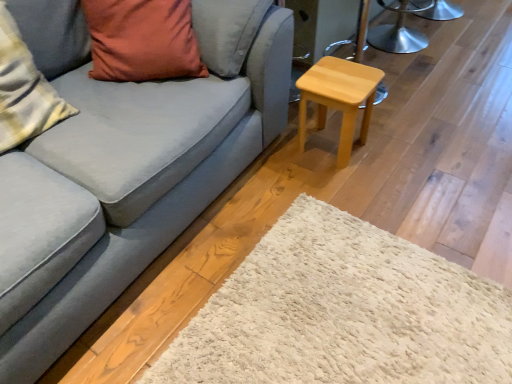
Question: From the image's perspective, is light wood/stained stool at right on matte orange pillow at upper left, which is counted as the second pillow, starting from the left?

Choices:
 (A) yes
 (B) no

Answer: (B)

Question: Can you confirm if light wood/stained stool at right is shorter than matte orange pillow at upper left, which is counted as the second pillow, starting from the left?

Choices:
 (A) no
 (B) yes

Answer: (B)

Question: Is light wood/stained stool at right wider than matte orange pillow at upper left, which is counted as the second pillow, starting from the left?

Choices:
 (A) yes
 (B) no

Answer: (B)

Question: Does light wood/stained stool at right appear on the right side of matte orange pillow at upper left, which is counted as the second pillow, starting from the left?

Choices:
 (A) no
 (B) yes

Answer: (B)

Question: Can you confirm if light wood/stained stool at right is smaller than matte orange pillow at upper left, which is counted as the second pillow, starting from the left?

Choices:
 (A) no
 (B) yes

Answer: (B)

Question: From the image's perspective, does light wood/stained stool at right appear lower than matte orange pillow at upper left, the first pillow in the right-to-left sequence?

Choices:
 (A) no
 (B) yes

Answer: (B)

Question: Is metallic silver stool at upper right not close to plush cotton pillow at left, arranged as the second pillow when viewed from the right?

Choices:
 (A) yes
 (B) no

Answer: (A)

Question: Is metallic silver stool at upper right thinner than plush cotton pillow at left, arranged as the second pillow when viewed from the right?

Choices:
 (A) yes
 (B) no

Answer: (B)

Question: Is metallic silver stool at upper right oriented towards plush cotton pillow at left, arranged as the second pillow when viewed from the right?

Choices:
 (A) yes
 (B) no

Answer: (B)

Question: Is metallic silver stool at upper right to the left of plush cotton pillow at left, which appears as the 1th pillow when viewed from the left, from the viewer's perspective?

Choices:
 (A) yes
 (B) no

Answer: (B)

Question: Does metallic silver stool at upper right have a smaller size compared to plush cotton pillow at left, arranged as the second pillow when viewed from the right?

Choices:
 (A) no
 (B) yes

Answer: (A)

Question: Can you confirm if metallic silver stool at upper right is shorter than plush cotton pillow at left, arranged as the second pillow when viewed from the right?

Choices:
 (A) yes
 (B) no

Answer: (A)

Question: Considering the relative sizes of plush cotton pillow at left, which appears as the 1th pillow when viewed from the left, and matte gray couch at center in the image provided, is plush cotton pillow at left, which appears as the 1th pillow when viewed from the left, thinner than matte gray couch at center?

Choices:
 (A) yes
 (B) no

Answer: (A)